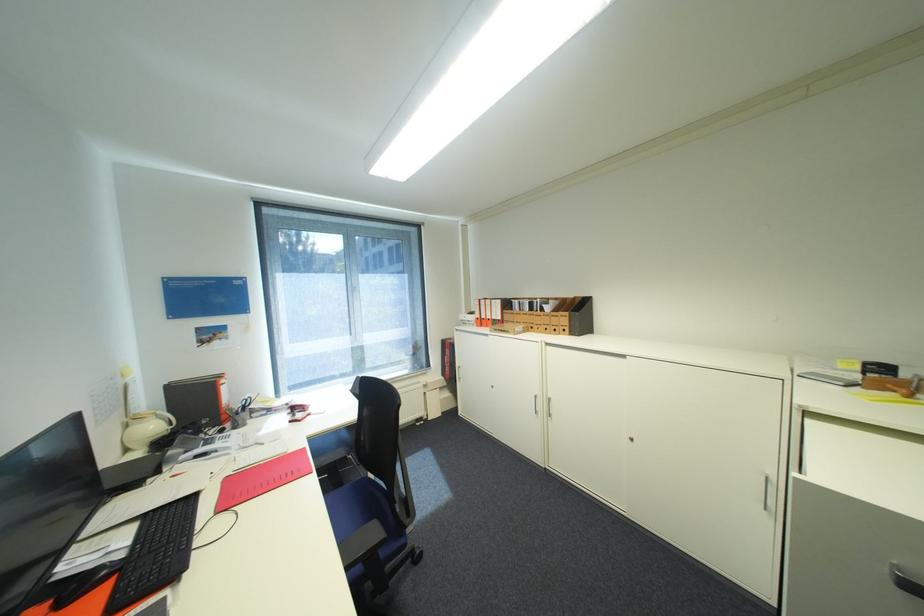
What do you see at coordinates (781, 515) in the screenshot? This screenshot has height=616, width=924. I see `the sliding door handle` at bounding box center [781, 515].